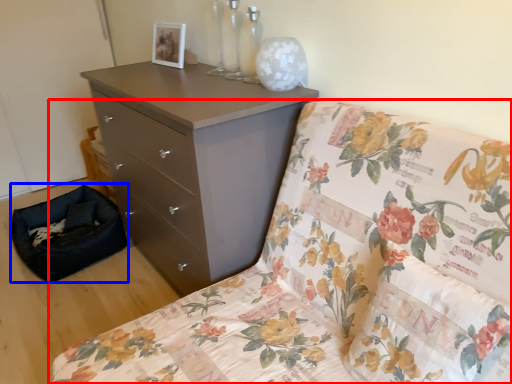
Question: Which of the following is the closest to the observer, furniture (highlighted by a red box) or footrest (highlighted by a blue box)?

Choices:
 (A) furniture
 (B) footrest

Answer: (A)